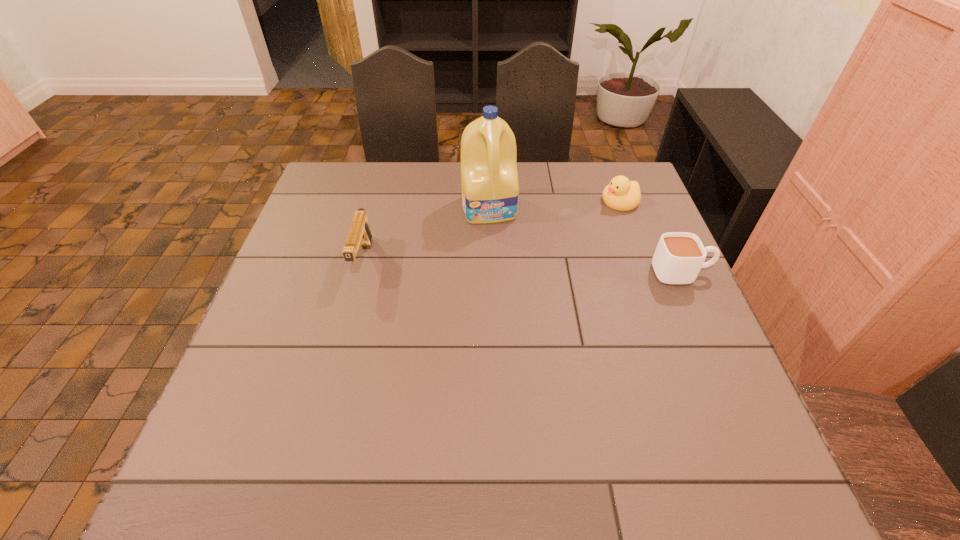
The width and height of the screenshot is (960, 540). Find the location of `free area in between the cup and the leftmost object`. free area in between the cup and the leftmost object is located at coordinates (522, 267).

Where is `free space between the third object from right to left and the cup`? This screenshot has width=960, height=540. free space between the third object from right to left and the cup is located at coordinates tap(586, 240).

Locate an element on the screen. The height and width of the screenshot is (540, 960). blank region between the third object from right to left and the pistol is located at coordinates (426, 234).

Identify which object is the closest to the cup. Please provide its 2D coordinates. Your answer should be formatted as a tuple, i.e. [(x, y)], where the tuple contains the x and y coordinates of a point satisfying the conditions above.

[(621, 194)]

Identify which object is the closest to the detergent. Please provide its 2D coordinates. Your answer should be formatted as a tuple, i.e. [(x, y)], where the tuple contains the x and y coordinates of a point satisfying the conditions above.

[(359, 233)]

You are a GUI agent. You are given a task and a screenshot of the screen. Output one action in this format:
    pyautogui.click(x=<x>, y=<y>)
    Task: Click on the vacant area that satisfies the following two spatial constraints: 1. at the barrel of the cup; 2. on the side with the handle of the pistol
    The height and width of the screenshot is (540, 960).
    Given the screenshot: What is the action you would take?
    pyautogui.click(x=360, y=273)

This screenshot has height=540, width=960. What are the coordinates of `free space that satisfies the following two spatial constraints: 1. at the barrel of the cup; 2. on the side with the handle of the pistol` in the screenshot? It's located at (360, 273).

Where is `vacant area that satisfies the following two spatial constraints: 1. at the barrel of the cup; 2. on the side with the handle of the leftmost object`? The width and height of the screenshot is (960, 540). vacant area that satisfies the following two spatial constraints: 1. at the barrel of the cup; 2. on the side with the handle of the leftmost object is located at coordinates (360, 273).

The width and height of the screenshot is (960, 540). Find the location of `free point that satisfies the following two spatial constraints: 1. at the barrel of the cup; 2. on the side with the handle of the pistol`. free point that satisfies the following two spatial constraints: 1. at the barrel of the cup; 2. on the side with the handle of the pistol is located at coordinates (360, 273).